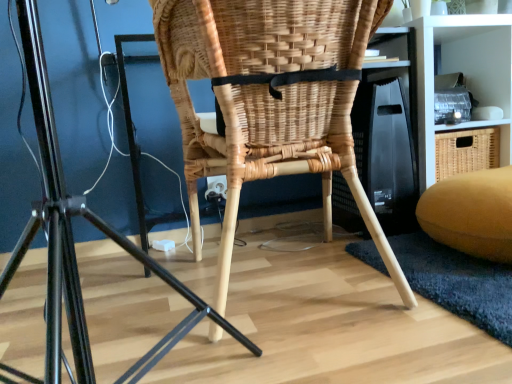
Question: Is white matte shelf at upper right not near natural woven chair at center?

Choices:
 (A) yes
 (B) no

Answer: (B)

Question: Considering the relative positions of white matte shelf at upper right and natural woven chair at center in the image provided, is white matte shelf at upper right to the left of natural woven chair at center from the viewer's perspective?

Choices:
 (A) no
 (B) yes

Answer: (A)

Question: Does white matte shelf at upper right lie behind natural woven chair at center?

Choices:
 (A) yes
 (B) no

Answer: (A)

Question: From a real-world perspective, is white matte shelf at upper right physically below natural woven chair at center?

Choices:
 (A) no
 (B) yes

Answer: (A)

Question: Is white matte shelf at upper right aimed at natural woven chair at center?

Choices:
 (A) no
 (B) yes

Answer: (A)

Question: From their relative heights in the image, would you say natural wicker chair at center is taller or shorter than natural woven chair at center?

Choices:
 (A) short
 (B) tall

Answer: (A)

Question: In terms of width, does natural wicker chair at center look wider or thinner when compared to natural woven chair at center?

Choices:
 (A) wide
 (B) thin

Answer: (B)

Question: Is natural wicker chair at center spatially inside natural woven chair at center, or outside of it?

Choices:
 (A) outside
 (B) inside

Answer: (A)

Question: Is natural wicker chair at center in front of or behind natural woven chair at center in the image?

Choices:
 (A) front
 (B) behind

Answer: (A)

Question: From the image's perspective, is natural wicker chair at center positioned above or below white matte shelf at upper right?

Choices:
 (A) above
 (B) below

Answer: (B)

Question: In terms of height, does natural wicker chair at center look taller or shorter compared to white matte shelf at upper right?

Choices:
 (A) short
 (B) tall

Answer: (A)

Question: Is natural wicker chair at center bigger or smaller than white matte shelf at upper right?

Choices:
 (A) small
 (B) big

Answer: (B)

Question: Is natural wicker chair at center wider or thinner than white matte shelf at upper right?

Choices:
 (A) thin
 (B) wide

Answer: (B)

Question: In the image, is natural wicker chair at center positioned in front of or behind velvet yellow bean bag at lower right?

Choices:
 (A) front
 (B) behind

Answer: (A)

Question: Is point (47, 167) positioned closer to the camera than point (458, 216)?

Choices:
 (A) closer
 (B) farther

Answer: (A)